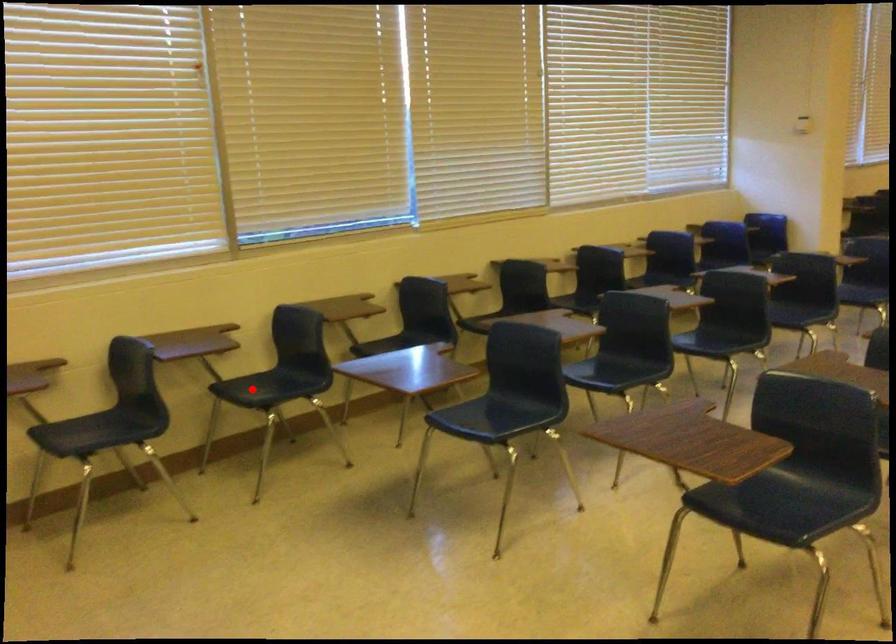
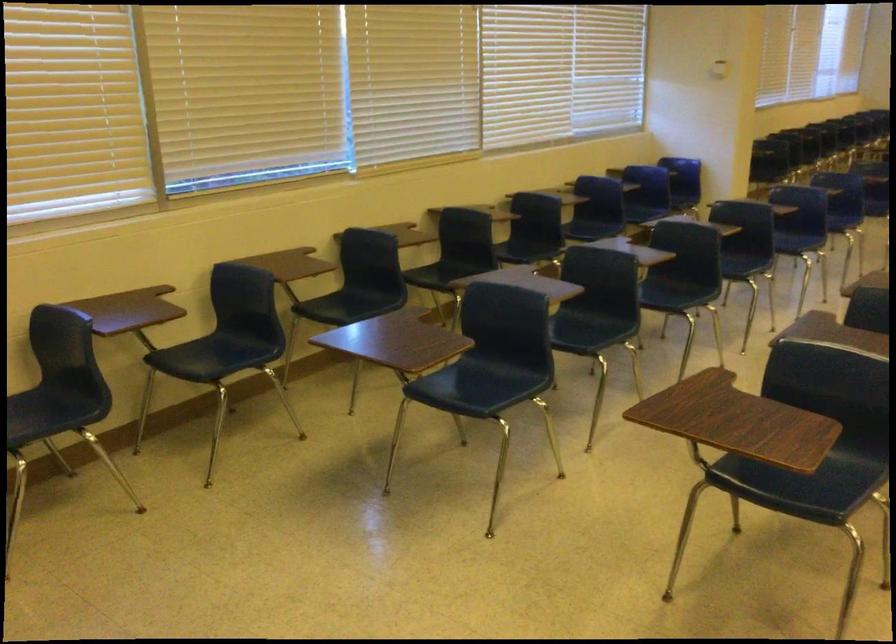
Question: A red point is marked in image1. In image2, is the corresponding 3D point closer to the camera or farther? Reply with the corresponding letter.

Choices:
 (A) The corresponding 3D point is closer.
 (B) The corresponding 3D point is farther.

Answer: (A)